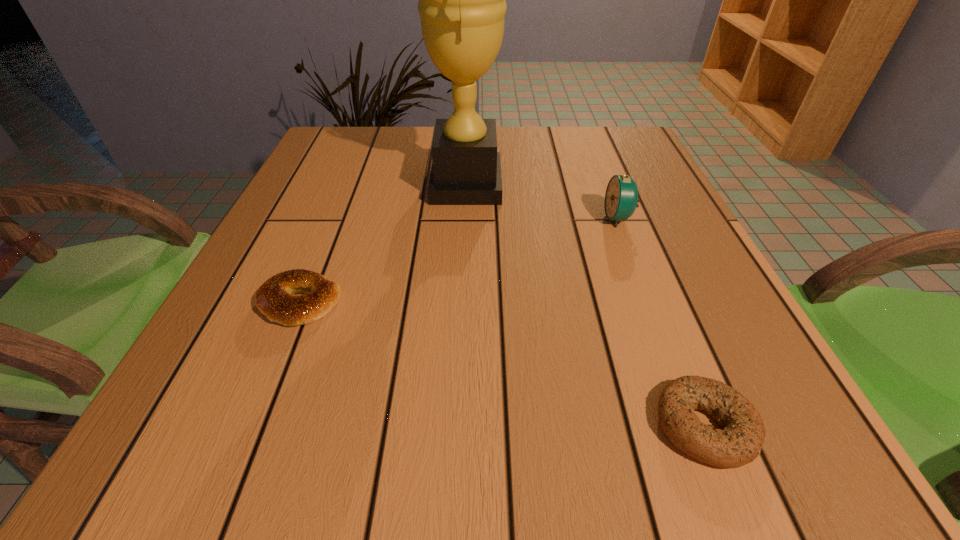
This screenshot has width=960, height=540. In the image, there is a desktop. What are the coordinates of `vacant space at the near edge` in the screenshot? It's located at (448, 421).

I want to click on vacant space at the left edge of the desktop, so 277,238.

You are a GUI agent. You are given a task and a screenshot of the screen. Output one action in this format:
    pyautogui.click(x=<x>, y=<y>)
    Task: Click on the vacant space at the right edge of the desktop
    This screenshot has height=540, width=960.
    Given the screenshot: What is the action you would take?
    646,179

The image size is (960, 540). In the image, there is a desktop. In order to click on free region at the far left corner in this screenshot , I will do `click(320, 141)`.

In order to click on free space at the near left corner of the desktop in this screenshot , I will do `click(203, 450)`.

In the image, there is a desktop. At what (x,y) coordinates should I click in order to perform the action: click on vacant space at the far right corner. Please return your answer as a coordinate pair (x, y). The image size is (960, 540). Looking at the image, I should click on (580, 134).

Find the location of a particular element. This screenshot has width=960, height=540. free space between the alarm clock and the nearest object is located at coordinates (661, 322).

At what (x,y) coordinates should I click in order to perform the action: click on vacant area between the second nearest object and the nearer bagel. Please return your answer as a coordinate pair (x, y). The width and height of the screenshot is (960, 540). Looking at the image, I should click on click(x=502, y=364).

At what (x,y) coordinates should I click in order to perform the action: click on vacant area between the third farthest object and the nearer bagel. Please return your answer as a coordinate pair (x, y). The width and height of the screenshot is (960, 540). Looking at the image, I should click on (502, 364).

The image size is (960, 540). Identify the location of empty location between the third shortest object and the leftmost object. (460, 260).